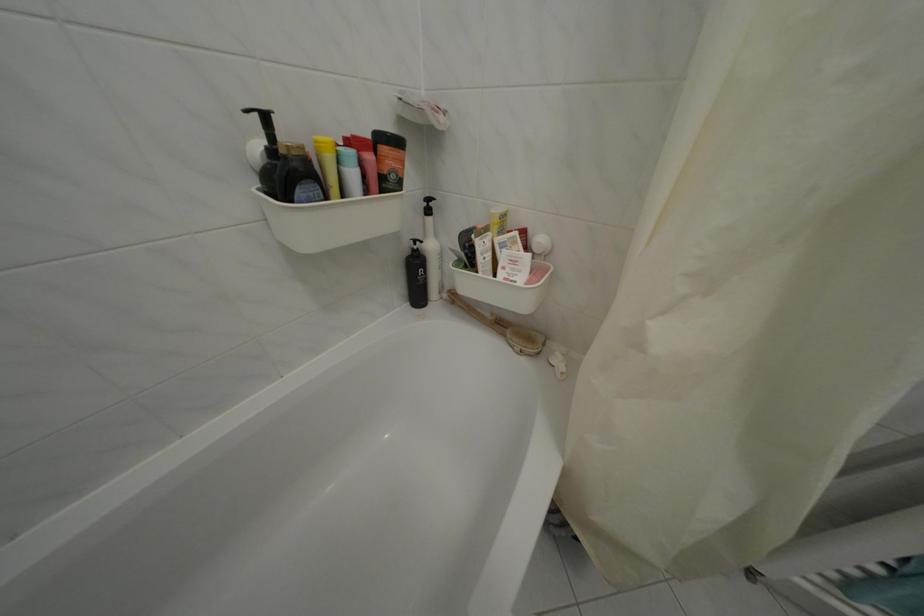
Where would you lift the light blue bottle? Please return your answer as a coordinate pair (x, y).

(431, 253)